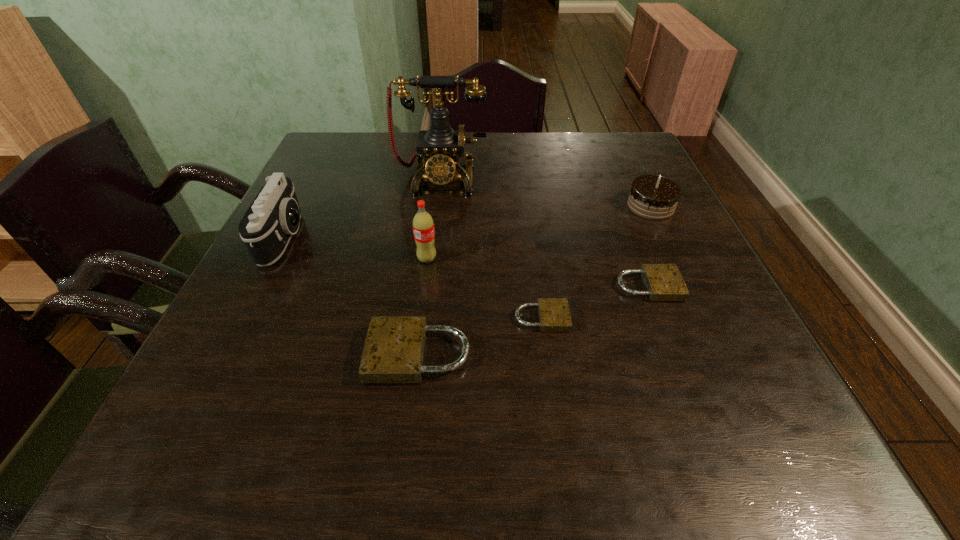
Identify the location of object that is at the near edge. This screenshot has width=960, height=540. (394, 348).

Where is `object located in the left edge section of the desktop`? This screenshot has width=960, height=540. object located in the left edge section of the desktop is located at coordinates (274, 216).

I want to click on padlock positioned at the right edge, so click(663, 282).

Where is `chocolate cake that is at the right edge`? Image resolution: width=960 pixels, height=540 pixels. chocolate cake that is at the right edge is located at coordinates (653, 197).

Where is `vacant space at the far edge`? This screenshot has height=540, width=960. vacant space at the far edge is located at coordinates (491, 137).

This screenshot has width=960, height=540. Find the location of `vacant area at the near edge`. vacant area at the near edge is located at coordinates (633, 395).

Where is `vacant area at the left edge of the desktop`? This screenshot has width=960, height=540. vacant area at the left edge of the desktop is located at coordinates (344, 224).

At what (x,y) coordinates should I click in order to perform the action: click on free region at the right edge. Please return your answer as a coordinate pair (x, y). Looking at the image, I should click on (692, 290).

Image resolution: width=960 pixels, height=540 pixels. I want to click on vacant space at the far right corner of the desktop, so click(x=600, y=154).

The image size is (960, 540). What are the coordinates of `vacant space at the near right corner of the desktop` in the screenshot? It's located at pyautogui.click(x=730, y=372).